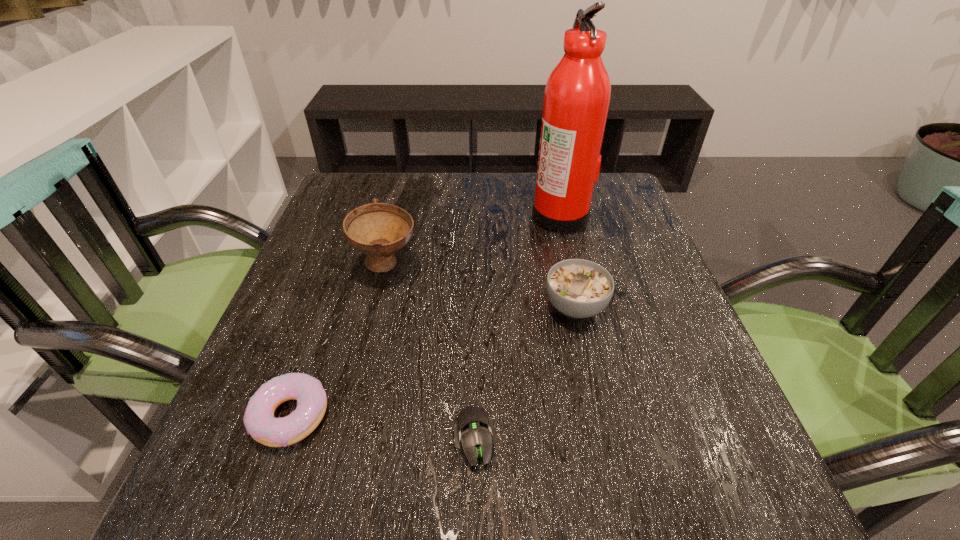
Locate an element on the screen. The width and height of the screenshot is (960, 540). free location located 0.380m on the label side of the fire extinguisher is located at coordinates (378, 215).

Locate an element on the screen. This screenshot has width=960, height=540. vacant space located 0.400m on the label side of the fire extinguisher is located at coordinates (370, 215).

This screenshot has height=540, width=960. In order to click on vacant space located 0.400m on the front of the second tallest object in this screenshot , I will do `click(331, 488)`.

Locate an element on the screen. Image resolution: width=960 pixels, height=540 pixels. free location located 0.190m on the back of the right soup bowl is located at coordinates (559, 230).

Identify the location of free spot located 0.320m on the back of the doughnut. (346, 260).

At what (x,y) coordinates should I click in order to perform the action: click on vacant position located on the right of the third object from right to left. Please return your answer as a coordinate pair (x, y). Image resolution: width=960 pixels, height=540 pixels. Looking at the image, I should click on (605, 439).

The image size is (960, 540). I want to click on object present at the far edge, so click(x=578, y=91).

You are a GUI agent. You are given a task and a screenshot of the screen. Output one action in this format:
    pyautogui.click(x=<x>, y=<y>)
    Task: Click on the object located at the near edge
    Image resolution: width=960 pixels, height=540 pixels.
    Given the screenshot: What is the action you would take?
    pyautogui.click(x=473, y=428)

Where is `soup bowl that is positioned at the left edge`? The width and height of the screenshot is (960, 540). soup bowl that is positioned at the left edge is located at coordinates (378, 230).

Find the location of a particular element. doughnut located at the left edge is located at coordinates (260, 423).